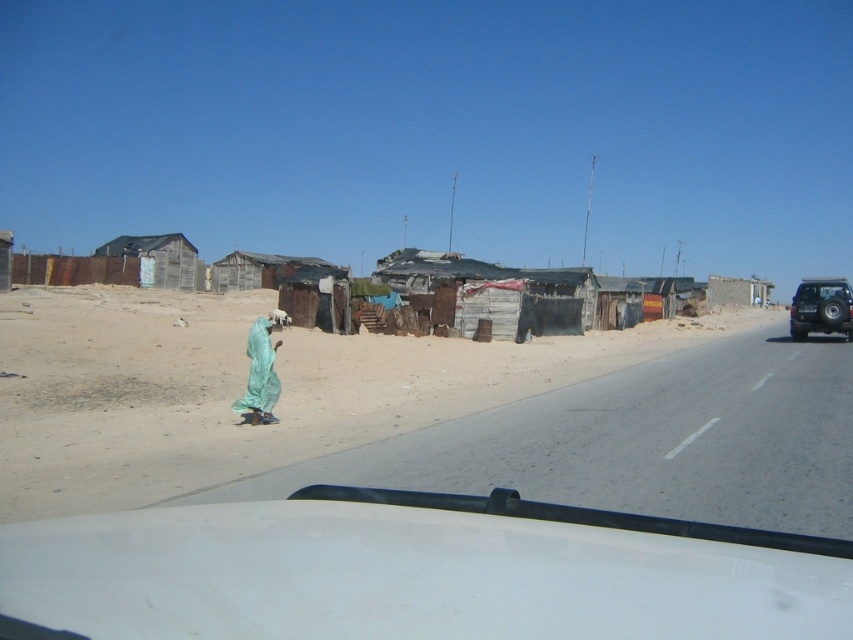
Which is more to the right, white matte car at lower center or brushed metal jeep at right?

From the viewer's perspective, brushed metal jeep at right appears more on the right side.

Between point (67, 541) and point (804, 339), which one is positioned in front?

Positioned in front is point (67, 541).

The width and height of the screenshot is (853, 640). What do you see at coordinates (415, 572) in the screenshot?
I see `white matte car at lower center` at bounding box center [415, 572].

This screenshot has height=640, width=853. I want to click on white matte car at lower center, so click(415, 572).

How distant is dark gray wooden hut at left from brushed metal jeep at right?

A distance of 44.74 meters exists between dark gray wooden hut at left and brushed metal jeep at right.

Does point (103, 250) lie behind point (831, 314)?

That is True.

Between point (149, 259) and point (844, 298), which one is positioned in front?

Point (844, 298) is in front.

Find the location of a particular element. This screenshot has height=640, width=853. dark gray wooden hut at left is located at coordinates (157, 259).

Is white matte car at lower center further to the viewer compared to dark gray wooden hut at left?

No.

Measure the distance between white matte car at lower center and dark gray wooden hut at left.

white matte car at lower center is 160.86 feet away from dark gray wooden hut at left.

This screenshot has height=640, width=853. I want to click on white matte car at lower center, so click(x=415, y=572).